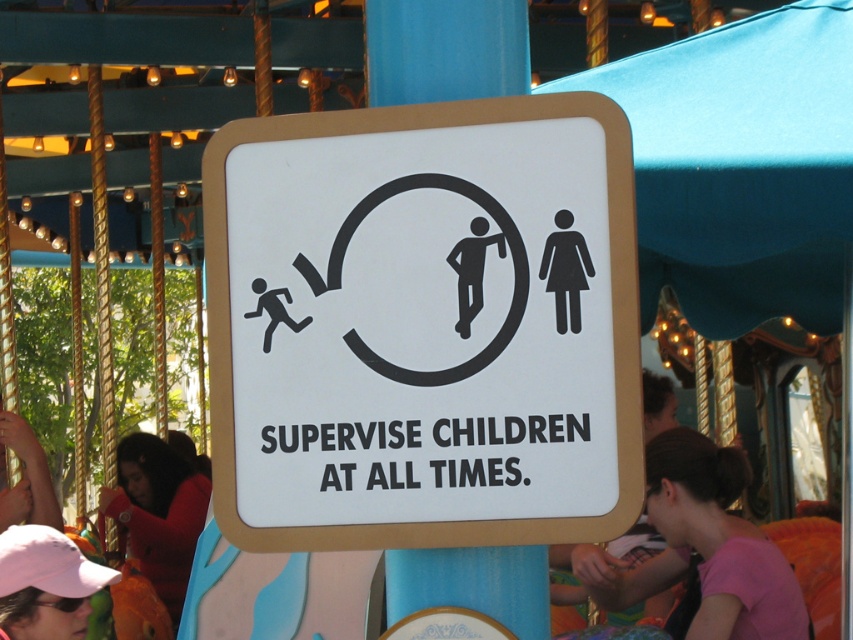
Question: Is red shirt at lower left bigger than pink fabric cap at lower left?

Choices:
 (A) yes
 (B) no

Answer: (A)

Question: Which object is farther from the camera taking this photo?

Choices:
 (A) blue plastic pole at center
 (B) pink fabric shirt at lower right
 (C) pink fabric cap at lower left

Answer: (B)

Question: Can you confirm if white plastic sign at center is wider than pink fabric shirt at lower right?

Choices:
 (A) no
 (B) yes

Answer: (B)

Question: Among these objects, which one is nearest to the camera?

Choices:
 (A) pink fabric cap at lower left
 (B) white plastic sign at center
 (C) pink fabric shirt at lower right

Answer: (B)

Question: Can you confirm if blue plastic pole at center is wider than pink fabric cap at lower left?

Choices:
 (A) no
 (B) yes

Answer: (A)

Question: Among these objects, which one is farthest from the camera?

Choices:
 (A) blue plastic pole at center
 (B) pink fabric cap at lower left
 (C) white plastic sign at center

Answer: (B)